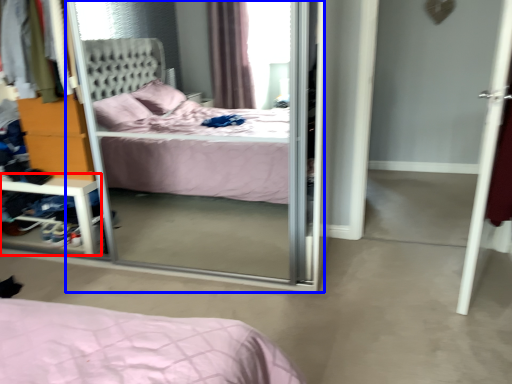
Question: Which object is further to the camera taking this photo, vanity (highlighted by a red box) or screen door (highlighted by a blue box)?

Choices:
 (A) vanity
 (B) screen door

Answer: (A)